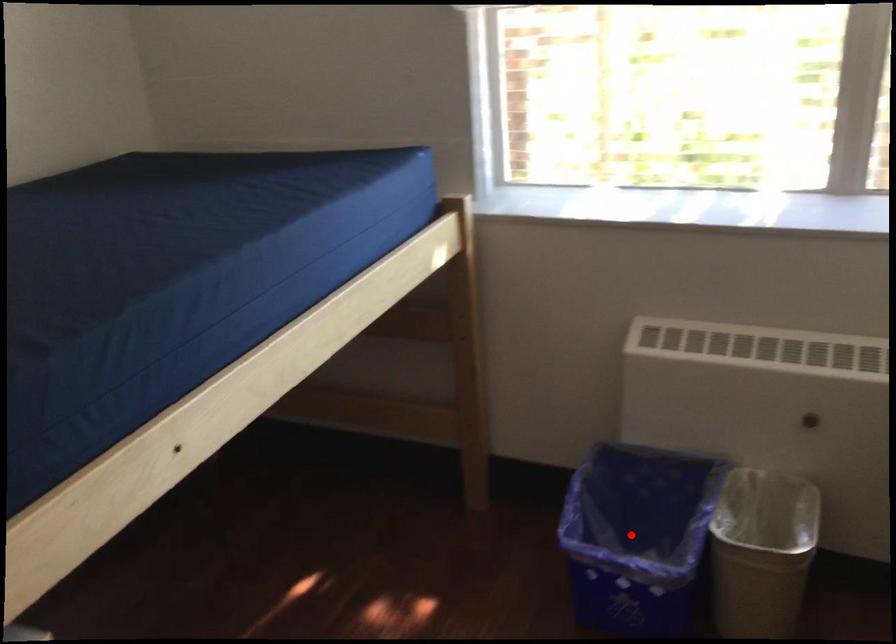
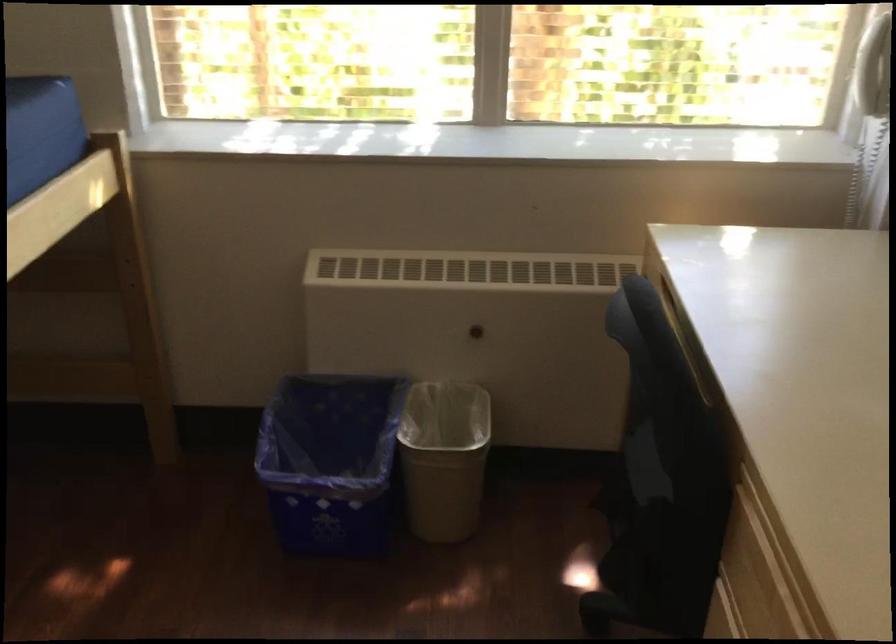
The point at the highlighted location is marked in the first image. Where is the corresponding point in the second image?

(330, 462)